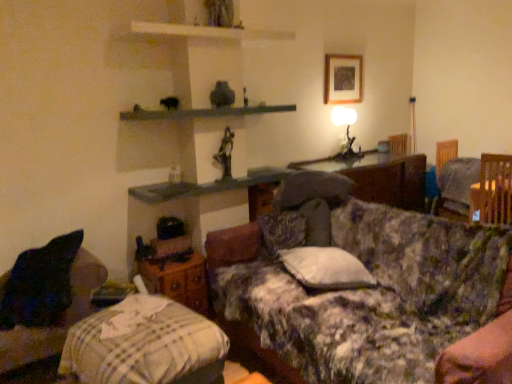
Question: Can you confirm if white soft pillow at center is positioned to the right of wooden swivel chair at right?

Choices:
 (A) yes
 (B) no

Answer: (B)

Question: Is white soft pillow at center thinner than wooden swivel chair at right?

Choices:
 (A) no
 (B) yes

Answer: (A)

Question: Is white soft pillow at center next to wooden swivel chair at right and touching it?

Choices:
 (A) no
 (B) yes

Answer: (A)

Question: Is white soft pillow at center closer to camera compared to wooden swivel chair at right?

Choices:
 (A) yes
 (B) no

Answer: (A)

Question: From the image's perspective, is white soft pillow at center on top of wooden swivel chair at right?

Choices:
 (A) no
 (B) yes

Answer: (A)

Question: Is white soft pillow at center looking in the opposite direction of wooden swivel chair at right?

Choices:
 (A) no
 (B) yes

Answer: (B)

Question: Is smooth gray stone mantle at upper center bigger than floral fabric couch at center?

Choices:
 (A) no
 (B) yes

Answer: (A)

Question: From a real-world perspective, is smooth gray stone mantle at upper center on floral fabric couch at center?

Choices:
 (A) yes
 (B) no

Answer: (A)

Question: Is smooth gray stone mantle at upper center positioned with its back to floral fabric couch at center?

Choices:
 (A) no
 (B) yes

Answer: (A)

Question: From the image's perspective, is smooth gray stone mantle at upper center beneath floral fabric couch at center?

Choices:
 (A) no
 (B) yes

Answer: (A)

Question: Is smooth gray stone mantle at upper center located outside floral fabric couch at center?

Choices:
 (A) yes
 (B) no

Answer: (A)

Question: Is smooth gray stone mantle at upper center aimed at floral fabric couch at center?

Choices:
 (A) yes
 (B) no

Answer: (B)

Question: Considering the relative positions of floral fabric couch at center and velvet dark blue pillow at lower left in the image provided, is floral fabric couch at center to the left of velvet dark blue pillow at lower left from the viewer's perspective?

Choices:
 (A) no
 (B) yes

Answer: (A)